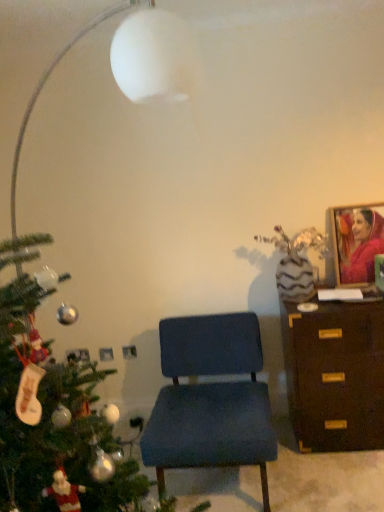
Describe the element at coordinates (335, 375) in the screenshot. I see `brown wooden chest of drawers at right` at that location.

I want to click on brown wooden chest of drawers at right, so click(x=335, y=375).

Does matte pink fabric portrait at upper right have a smaller size compared to brown wooden chest of drawers at right?

Indeed, matte pink fabric portrait at upper right has a smaller size compared to brown wooden chest of drawers at right.

Is matte pink fabric portrait at upper right situated inside brown wooden chest of drawers at right or outside?

matte pink fabric portrait at upper right is spatially situated outside brown wooden chest of drawers at right.

From the image's perspective, relative to brown wooden chest of drawers at right, is matte pink fabric portrait at upper right above or below?

Based on their image positions, matte pink fabric portrait at upper right is located above brown wooden chest of drawers at right.

Who is taller, matte pink fabric portrait at upper right or brown wooden chest of drawers at right?

brown wooden chest of drawers at right is taller.

Which of these two, brown wooden chest of drawers at right or blue fabric chair at center, is smaller?

Smaller between the two is brown wooden chest of drawers at right.

From the image's perspective, which is above, brown wooden chest of drawers at right or blue fabric chair at center?

brown wooden chest of drawers at right.

Identify the location of the chest of drawers located behind the blue fabric chair at center. The image size is (384, 512). (335, 375).

Looking at this image, is blue fabric chair at center at the left side of matte pink fabric portrait at upper right?

Indeed, blue fabric chair at center is positioned on the left side of matte pink fabric portrait at upper right.

From the image's perspective, who appears lower, blue fabric chair at center or matte pink fabric portrait at upper right?

blue fabric chair at center.

In terms of width, does blue fabric chair at center look wider or thinner when compared to matte pink fabric portrait at upper right?

blue fabric chair at center is wider than matte pink fabric portrait at upper right.

Is blue fabric chair at center oriented away from matte pink fabric portrait at upper right?

blue fabric chair at center is not turned away from matte pink fabric portrait at upper right.

Between matte pink fabric portrait at upper right and blue fabric chair at center, which one has smaller size?

matte pink fabric portrait at upper right.

Is matte pink fabric portrait at upper right at the left side of blue fabric chair at center?

In fact, matte pink fabric portrait at upper right is to the right of blue fabric chair at center.

From a real-world perspective, which object rests below the other?

From a 3D spatial view, blue fabric chair at center is below.

Identify the location of chair in front of the matte pink fabric portrait at upper right. The image size is (384, 512). (210, 399).

Is brown wooden chest of drawers at right a part of blue fabric chair at center?

No, brown wooden chest of drawers at right is located outside of blue fabric chair at center.

From the picture: Considering the relative sizes of blue fabric chair at center and brown wooden chest of drawers at right in the image provided, is blue fabric chair at center shorter than brown wooden chest of drawers at right?

Yes.

Would you say blue fabric chair at center is to the left or to the right of brown wooden chest of drawers at right in the picture?

Based on their positions, blue fabric chair at center is located to the left of brown wooden chest of drawers at right.

Considering the sizes of objects blue fabric chair at center and brown wooden chest of drawers at right in the image provided, who is thinner, blue fabric chair at center or brown wooden chest of drawers at right?

brown wooden chest of drawers at right is thinner.

In the scene shown: Is brown wooden chest of drawers at right taller than matte pink fabric portrait at upper right?

Yes, brown wooden chest of drawers at right is taller than matte pink fabric portrait at upper right.

Measure the distance between brown wooden chest of drawers at right and matte pink fabric portrait at upper right.

They are 52.68 centimeters apart.

Considering the relative sizes of brown wooden chest of drawers at right and matte pink fabric portrait at upper right in the image provided, is brown wooden chest of drawers at right smaller than matte pink fabric portrait at upper right?

No, brown wooden chest of drawers at right is not smaller than matte pink fabric portrait at upper right.

Which of these two, brown wooden chest of drawers at right or matte pink fabric portrait at upper right, is wider?

Wider between the two is brown wooden chest of drawers at right.

I want to click on person above the brown wooden chest of drawers at right (from the image's perspective), so click(x=364, y=248).

At what (x,y) coordinates should I click in order to perform the action: click on chair in front of the brown wooden chest of drawers at right. Please return your answer as a coordinate pair (x, y). This screenshot has width=384, height=512. Looking at the image, I should click on (210, 399).

When comparing their distances from blue fabric chair at center, does brown wooden chest of drawers at right or matte pink fabric portrait at upper right seem closer?

Based on the image, brown wooden chest of drawers at right appears to be nearer to blue fabric chair at center.

Which object lies further to the anchor point brown wooden chest of drawers at right, matte pink fabric portrait at upper right or blue fabric chair at center?

Based on the image, matte pink fabric portrait at upper right appears to be further to brown wooden chest of drawers at right.

Considering their positions, is blue fabric chair at center positioned further to matte pink fabric portrait at upper right than brown wooden chest of drawers at right?

blue fabric chair at center lies further to matte pink fabric portrait at upper right than the other object.

Which object lies nearer to the anchor point matte pink fabric portrait at upper right, brown wooden chest of drawers at right or blue fabric chair at center?

Based on the image, brown wooden chest of drawers at right appears to be nearer to matte pink fabric portrait at upper right.

Considering their positions, is matte pink fabric portrait at upper right positioned further to blue fabric chair at center than brown wooden chest of drawers at right?

Based on the image, matte pink fabric portrait at upper right appears to be further to blue fabric chair at center.

Which object lies further to the anchor point brown wooden chest of drawers at right, blue fabric chair at center or matte pink fabric portrait at upper right?

Based on the image, matte pink fabric portrait at upper right appears to be further to brown wooden chest of drawers at right.

Locate an element on the screen. This screenshot has width=384, height=512. the chest of drawers situated between blue fabric chair at center and matte pink fabric portrait at upper right from left to right is located at coordinates (335, 375).